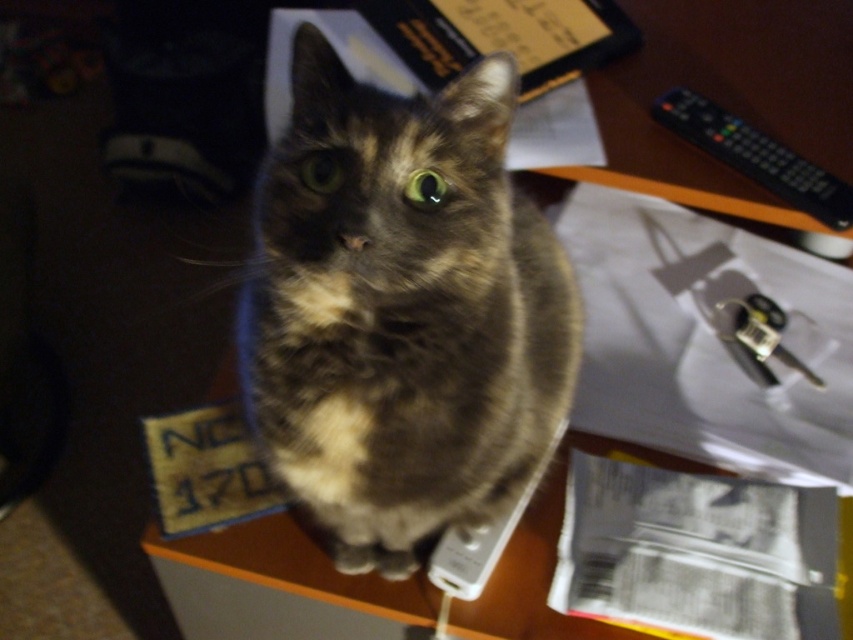
Between tabby fur cat at center and black plastic remote at upper right, which one has less height?

black plastic remote at upper right is shorter.

What do you see at coordinates (401, 310) in the screenshot? I see `tabby fur cat at center` at bounding box center [401, 310].

Does point (393, 448) lie in front of point (703, 131)?

Yes, point (393, 448) is in front of point (703, 131).

You are a GUI agent. You are given a task and a screenshot of the screen. Output one action in this format:
    pyautogui.click(x=<x>, y=<y>)
    Task: Click on the tabby fur cat at center
    The image size is (853, 640).
    Given the screenshot: What is the action you would take?
    pyautogui.click(x=401, y=310)